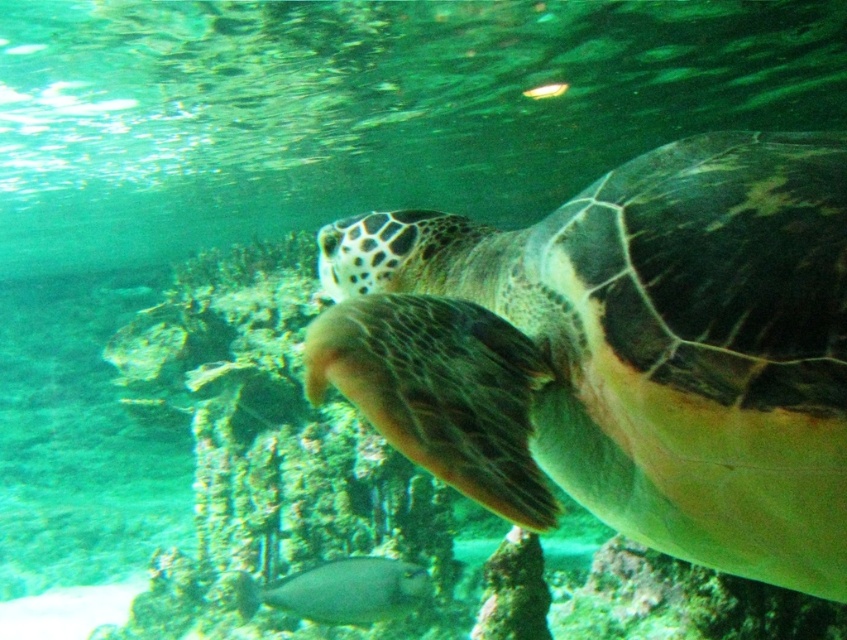
Can you confirm if green matte turtle at center is taller than shiny silver fish at center?

Yes.

Is green matte turtle at center below shiny silver fish at center?

Incorrect, green matte turtle at center is not positioned below shiny silver fish at center.

Where is `green matte turtle at center`? green matte turtle at center is located at coordinates (623, 352).

I want to click on green matte turtle at center, so click(x=623, y=352).